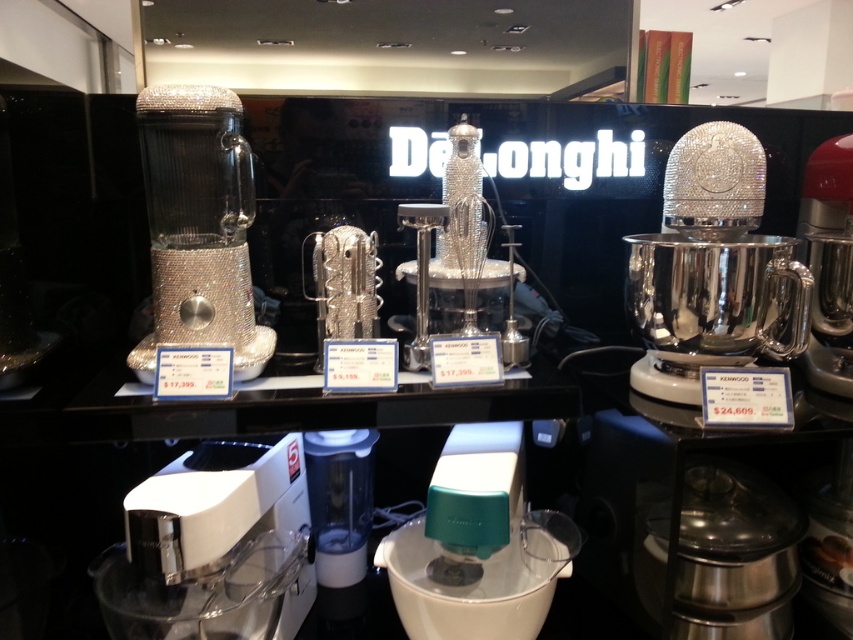
Question: Is white plastic food processor at lower left above white plastic blender at center?

Choices:
 (A) no
 (B) yes

Answer: (A)

Question: Among these objects, which one is farthest from the camera?

Choices:
 (A) white plastic blender at center
 (B) red metallic mixer at right
 (C) sparkly silver blender at left
 (D) polished silver mixer at right

Answer: (B)

Question: In this image, where is white plastic food processor at lower left located relative to sparkly silver blender at left?

Choices:
 (A) above
 (B) below

Answer: (B)

Question: From the image, what is the correct spatial relationship of polished silver mixer at right in relation to sparkly silver mixer at center?

Choices:
 (A) right
 (B) left

Answer: (A)

Question: Which object appears closest to the camera in this image?

Choices:
 (A) red metallic mixer at right
 (B) polished silver mixer at right
 (C) white plastic food processor at lower left
 (D) sparkly silver mixer at center

Answer: (C)

Question: Which is nearer to the white plastic food processor at lower left?

Choices:
 (A) white plastic blender at center
 (B) sparkly silver blender at left

Answer: (A)